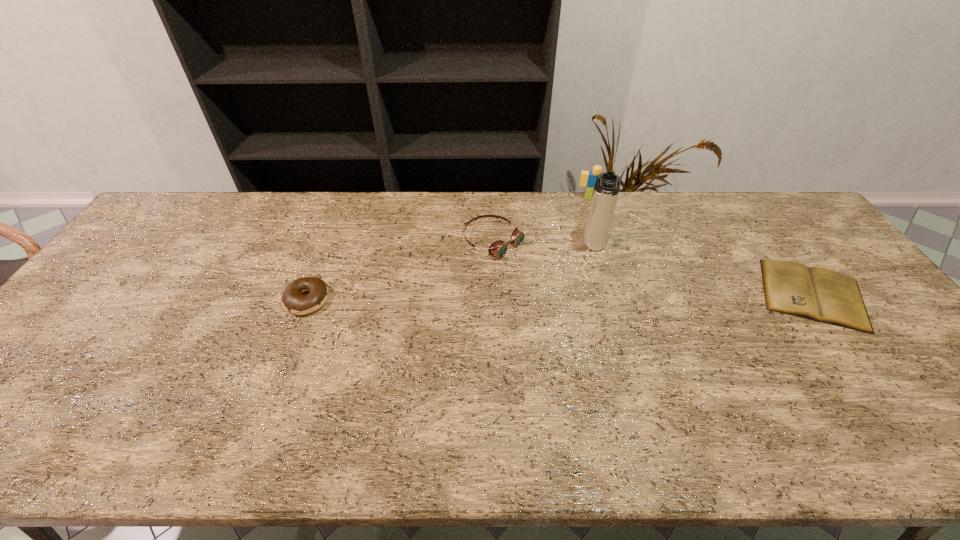
This screenshot has width=960, height=540. Find the location of `vacant point located between the fourth object from right to left and the doughnut`. vacant point located between the fourth object from right to left and the doughnut is located at coordinates (400, 271).

Where is `vacant space that is in between the shortest object and the tallest object`? This screenshot has height=540, width=960. vacant space that is in between the shortest object and the tallest object is located at coordinates (704, 271).

This screenshot has height=540, width=960. In order to click on empty space between the leftmost object and the shortest object in this screenshot , I will do `click(560, 298)`.

At what (x,y) coordinates should I click in order to perform the action: click on empty space between the third tallest object and the tallest object. Please return your answer as a coordinate pair (x, y). The image size is (960, 540). Looking at the image, I should click on (544, 245).

Where is `vacant area between the farthest object and the second object from left to right`? This screenshot has width=960, height=540. vacant area between the farthest object and the second object from left to right is located at coordinates (542, 220).

The width and height of the screenshot is (960, 540). I want to click on vacant point located between the leftmost object and the thermos bottle, so click(450, 274).

You are a GUI agent. You are given a task and a screenshot of the screen. Output one action in this format:
    pyautogui.click(x=<x>, y=<y>)
    Task: Click on the vacant area between the thermos bottle and the second object from left to right
    
    Given the screenshot: What is the action you would take?
    pyautogui.click(x=544, y=245)

Locate an element on the screen. This screenshot has height=540, width=960. free space between the goggles and the tallest object is located at coordinates (544, 245).

Find the location of a particular element. This screenshot has width=960, height=540. vacant point located between the fourth tallest object and the Lego is located at coordinates click(x=449, y=249).

This screenshot has height=540, width=960. I want to click on object that ranks as the third closest to the shortest object, so click(x=499, y=248).